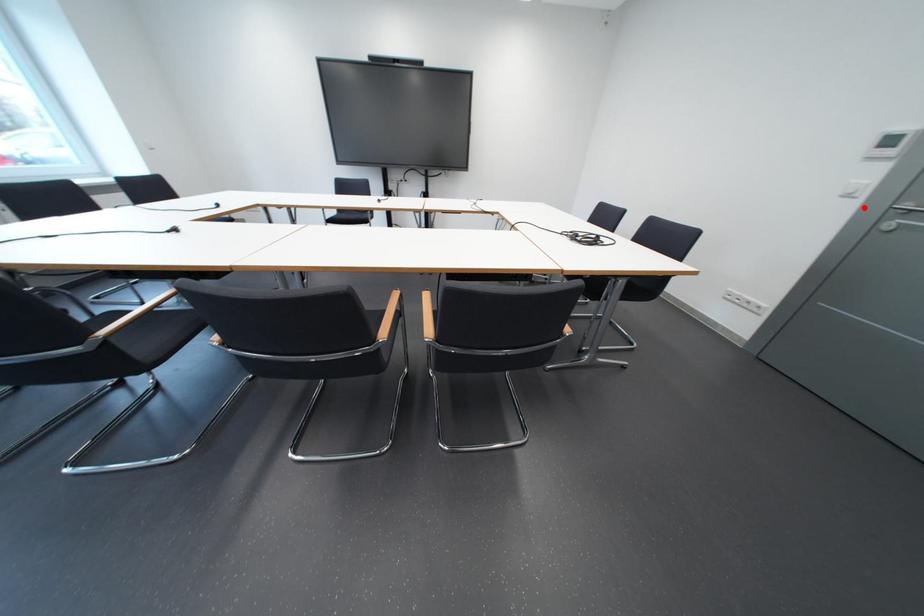
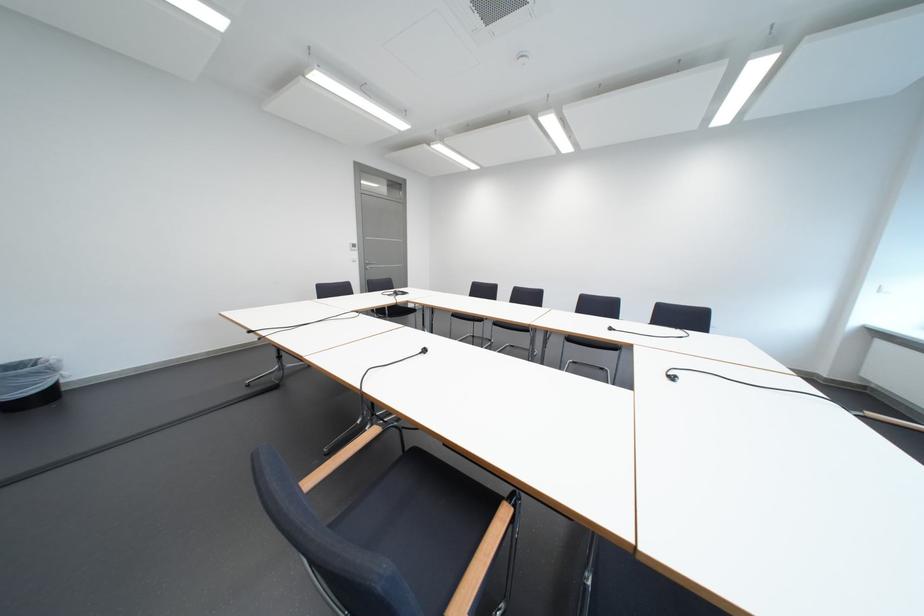
In the second image, find the point that corresponds to the highlighted location in the first image.

(369, 265)